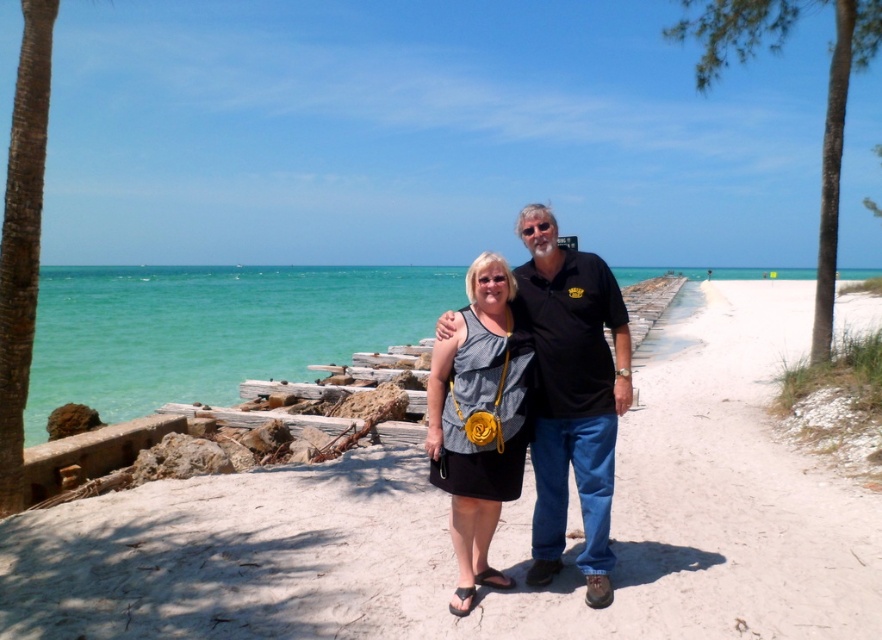
Is point (544, 385) positioned in front of point (514, 348)?

That is False.

Between point (594, 420) and point (460, 545), which one is positioned in front?

Positioned in front is point (460, 545).

Which is behind, point (582, 401) or point (473, 330)?

Positioned behind is point (582, 401).

This screenshot has width=882, height=640. I want to click on matte black shirt at center, so click(572, 396).

Does matte gray dress at center appear under green leafy palm tree at upper right?

Yes, matte gray dress at center is below green leafy palm tree at upper right.

Who is positioned more to the left, matte gray dress at center or green leafy palm tree at upper right?

matte gray dress at center

Is point (436, 387) positioned behind point (831, 113)?

No, (436, 387) is in front of (831, 113).

Locate an element on the screen. The image size is (882, 640). matte gray dress at center is located at coordinates 477,420.

Based on the photo, between clear blue water at center and matte gray dress at center, which one has less height?

With less height is matte gray dress at center.

Between clear blue water at center and matte gray dress at center, which one appears on the left side from the viewer's perspective?

clear blue water at center is more to the left.

Is point (342, 332) positioned in front of point (437, 397)?

No, it is behind (437, 397).

Locate an element on the screen. The image size is (882, 640). clear blue water at center is located at coordinates (214, 330).